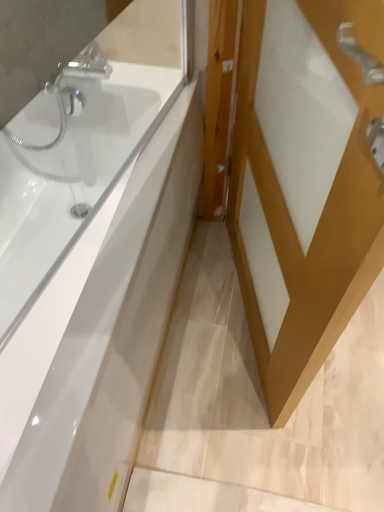
Image resolution: width=384 pixels, height=512 pixels. What do you see at coordinates (80, 150) in the screenshot?
I see `white glossy bathtub at upper left` at bounding box center [80, 150].

Identify the location of white glossy bathtub at upper left. Image resolution: width=384 pixels, height=512 pixels. (80, 150).

Measure the distance between point (268, 318) and camera.

Point (268, 318) is 3.82 feet away from camera.

What is the approximate height of white matte door at center?

The height of white matte door at center is 36.79 inches.

What do you see at coordinates (304, 183) in the screenshot? The width and height of the screenshot is (384, 512). I see `white matte door at center` at bounding box center [304, 183].

At what (x,y) coordinates should I click in order to perform the action: click on white matte door at center. Please return your answer as a coordinate pair (x, y). Looking at the image, I should click on (304, 183).

Where is `white glossy bathtub at upper left`? This screenshot has height=512, width=384. white glossy bathtub at upper left is located at coordinates (80, 150).

From the picture: Considering the relative positions of white matte door at center and white glossy bathtub at upper left in the image provided, is white matte door at center to the left or to the right of white glossy bathtub at upper left?

white matte door at center is to the right of white glossy bathtub at upper left.

Which object is further away from the camera, white matte door at center or white glossy bathtub at upper left?

Positioned behind is white glossy bathtub at upper left.

Considering the positions of points (299, 241) and (149, 39), is point (299, 241) farther from camera compared to point (149, 39)?

That is False.

From the image's perspective, is white matte door at center under white glossy bathtub at upper left?

No, from the image's perspective, white matte door at center is not below white glossy bathtub at upper left.

From a real-world perspective, is white matte door at center positioned above or below white glossy bathtub at upper left?

white matte door at center is situated higher than white glossy bathtub at upper left in the real world.

Considering the sizes of objects white matte door at center and white glossy bathtub at upper left in the image provided, who is thinner, white matte door at center or white glossy bathtub at upper left?

Thinner between the two is white matte door at center.

Which of these two, white matte door at center or white glossy bathtub at upper left, stands taller?

Standing taller between the two is white matte door at center.

Considering the sizes of objects white matte door at center and white glossy bathtub at upper left in the image provided, who is bigger, white matte door at center or white glossy bathtub at upper left?

With larger size is white glossy bathtub at upper left.

Would you say white glossy bathtub at upper left is part of white matte door at center's contents?

Definitely not — white glossy bathtub at upper left is not inside white matte door at center.

Is white matte door at center not near white glossy bathtub at upper left?

No, white matte door at center is in close proximity to white glossy bathtub at upper left.

Is white matte door at center oriented towards white glossy bathtub at upper left?

Yes.

Measure the distance from white matte door at center to white glossy bathtub at upper left.

The distance of white matte door at center from white glossy bathtub at upper left is 16.92 inches.

Locate an element on the screen. door above the white glossy bathtub at upper left (from the image's perspective) is located at coordinates (304, 183).

Which object is positioned more to the right, white glossy bathtub at upper left or white matte door at center?

Positioned to the right is white matte door at center.

Between white glossy bathtub at upper left and white matte door at center, which one is positioned in front?

white matte door at center.

Does point (164, 50) come in front of point (329, 325)?

That is False.

From the image's perspective, would you say white glossy bathtub at upper left is positioned over white matte door at center?

Actually, white glossy bathtub at upper left appears below white matte door at center in the image.

From a real-world perspective, is white glossy bathtub at upper left beneath white matte door at center?

Yes, from a real-world perspective, white glossy bathtub at upper left is below white matte door at center.

Is white glossy bathtub at upper left thinner than white matte door at center?

In fact, white glossy bathtub at upper left might be wider than white matte door at center.

Between white glossy bathtub at upper left and white matte door at center, which one has less height?

Standing shorter between the two is white glossy bathtub at upper left.

Which of these two, white glossy bathtub at upper left or white matte door at center, is bigger?

white glossy bathtub at upper left.

Could white matte door at center be considered to be inside white glossy bathtub at upper left?

Definitely not — white matte door at center is not inside white glossy bathtub at upper left.

Is white glossy bathtub at upper left positioned far away from white matte door at center?

They are positioned close to each other.

Is white glossy bathtub at upper left looking in the opposite direction of white matte door at center?

white glossy bathtub at upper left does not have its back to white matte door at center.

How different are the orientations of white glossy bathtub at upper left and white matte door at center in degrees?

There is a 18-degree angle between the facing directions of white glossy bathtub at upper left and white matte door at center.

Find the location of `door in front of the white glossy bathtub at upper left`. door in front of the white glossy bathtub at upper left is located at coordinates (304, 183).

Locate an element on the screen. bathtub beneath the white matte door at center (from a real-world perspective) is located at coordinates (80, 150).

I want to click on door in front of the white glossy bathtub at upper left, so click(x=304, y=183).